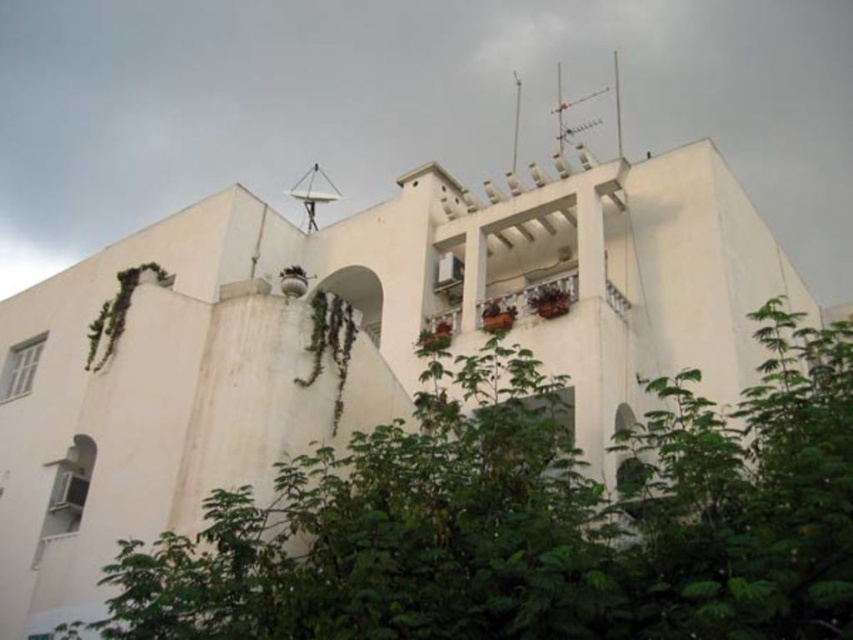
Does point (660, 540) come behind point (111, 339)?

That is False.

Measure the distance between green leafy tree at center and camera.

green leafy tree at center and camera are 28.29 meters apart from each other.

Locate an element on the screen. The image size is (853, 640). green leafy tree at center is located at coordinates (532, 516).